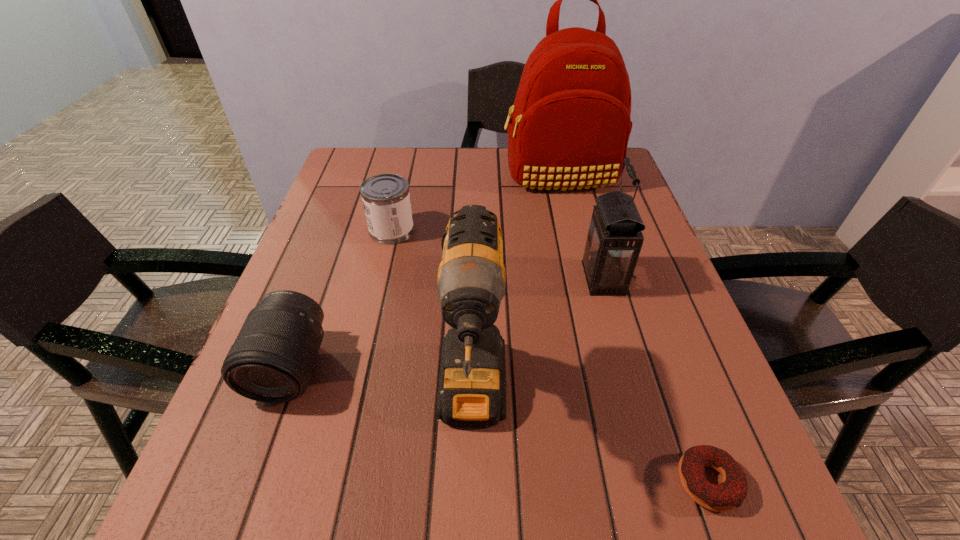
Image resolution: width=960 pixels, height=540 pixels. In order to click on free space at the right edge in this screenshot , I will do `click(655, 301)`.

Find the location of a particular element. free space between the fifth shortest object and the lantern is located at coordinates (538, 341).

Where is `blank region between the fifth nearest object and the telephoto lens`? blank region between the fifth nearest object and the telephoto lens is located at coordinates (342, 299).

This screenshot has height=540, width=960. Identify the location of vacant point located between the second object from left to right and the shortest object. (550, 356).

Where is `empty location between the telephoto lens and the fifth shortest object`? The image size is (960, 540). empty location between the telephoto lens and the fifth shortest object is located at coordinates (382, 384).

Find the location of `free space that is in between the backpack and the telephoto lens`. free space that is in between the backpack and the telephoto lens is located at coordinates (425, 271).

Identify the location of free spot between the second tallest object and the third tallest object. (538, 341).

Locate an element on the screen. empty location between the drill and the shortest object is located at coordinates (590, 442).

You are a GUI agent. You are given a task and a screenshot of the screen. Output one action in this format:
    pyautogui.click(x=<x>, y=<y>)
    Task: Click on the closest object to the drill
    
    Given the screenshot: What is the action you would take?
    pyautogui.click(x=272, y=360)

Point out which object is positioned as the fourth nearest to the third farthest object. Please provide its 2D coordinates. Your answer should be formatted as a tuple, i.e. [(x, y)], where the tuple contains the x and y coordinates of a point satisfying the conditions above.

[(386, 199)]